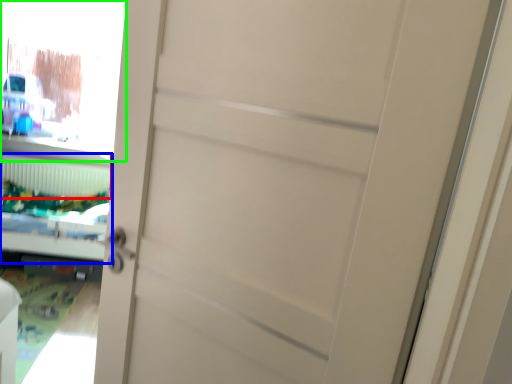
Question: Estimate the real-world distances between objects in this image. Which object is farther from radiator (highlighted by a red box), bed (highlighted by a blue box) or window screen (highlighted by a green box)?

Choices:
 (A) bed
 (B) window screen

Answer: (B)